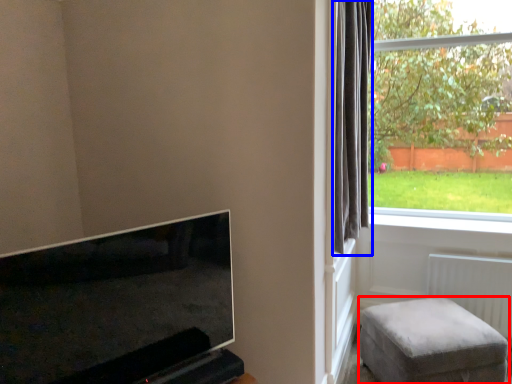
Question: Which object is closer to the camera taking this photo, furniture (highlighted by a red box) or curtain (highlighted by a blue box)?

Choices:
 (A) furniture
 (B) curtain

Answer: (B)